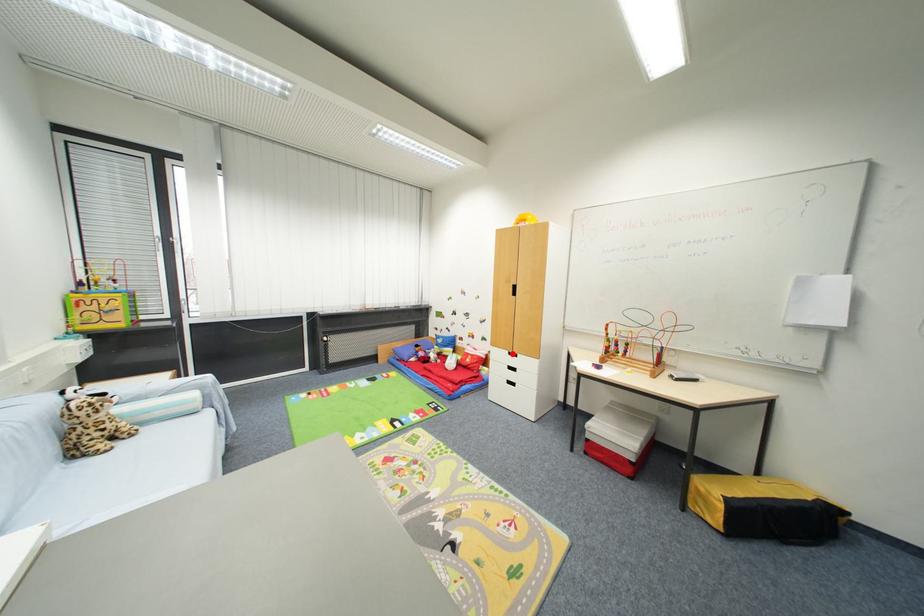
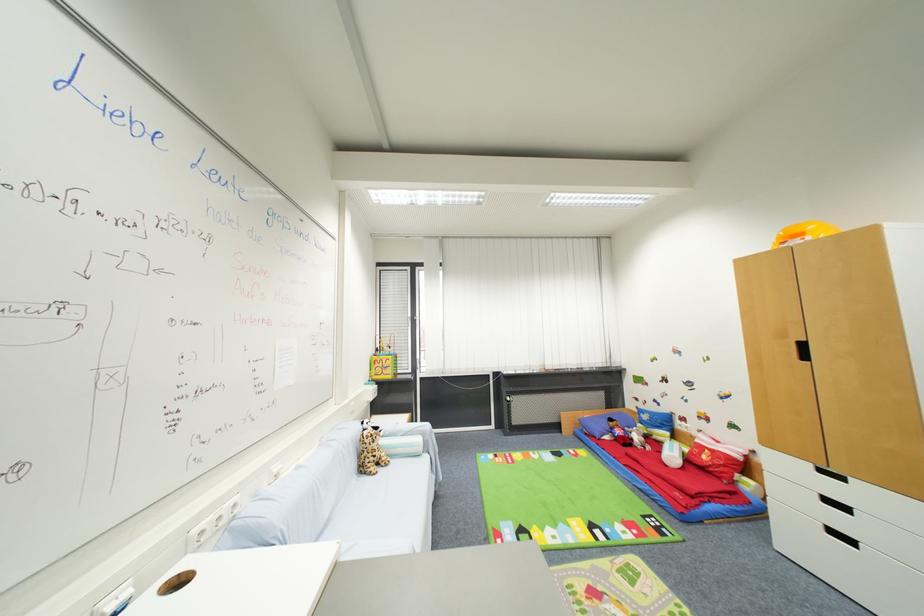
Question: A red point is marked in image1. In image2, is the corresponding 3D point closer to the camera or farther? Reply with the corresponding letter.

Choices:
 (A) The corresponding 3D point is closer.
 (B) The corresponding 3D point is farther.

Answer: (A)